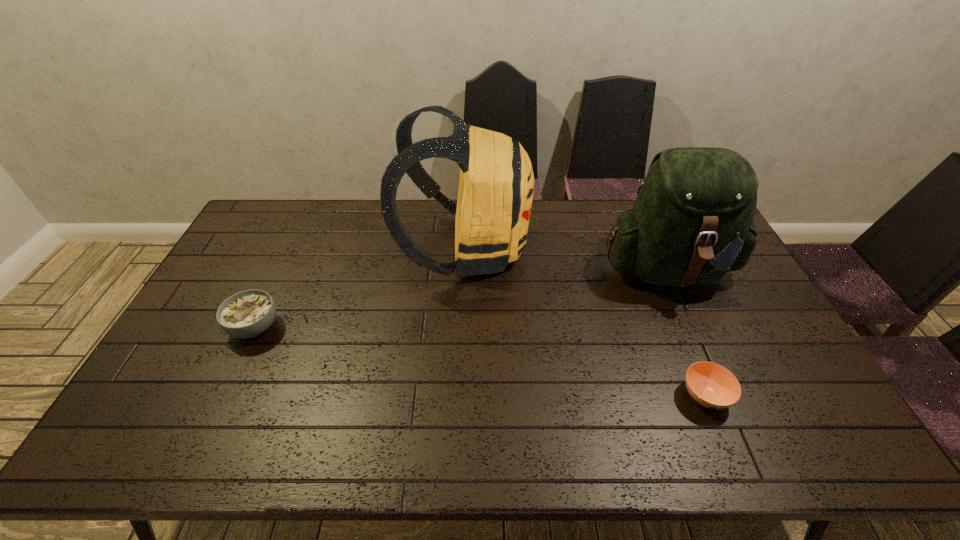
You are a GUI agent. You are given a task and a screenshot of the screen. Output one action in this format:
    pyautogui.click(x=<x>, y=<y>)
    Task: Click on the vacant area in the image that satisfies the following two spatial constraints: 1. on the front-facing side of the left backpack; 2. on the back side of the shorter soup bowl
    The image size is (960, 540).
    Given the screenshot: What is the action you would take?
    pyautogui.click(x=459, y=396)